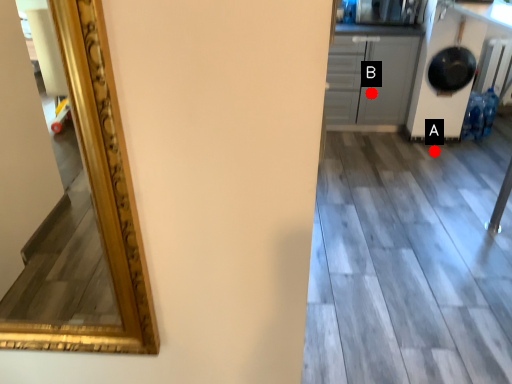
Question: Two points are circled on the image, labeled by A and B beside each circle. Which of the following is the closest to the observer?

Choices:
 (A) A is closer
 (B) B is closer

Answer: (A)